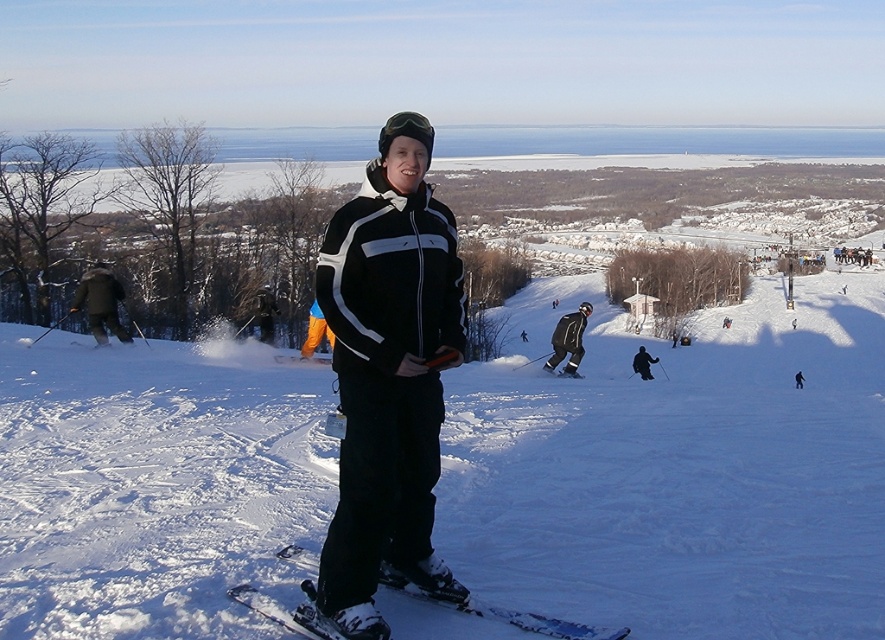
You are a ski instructor preparing for a lesson. You have two skis available in the image, the white plastic ski at center and the black matte ski suit at center. Which one is narrower?

The white plastic ski at center is thinner than the black matte ski suit at center, so the white plastic ski at center is narrower.

You are a photographer at the ski resort and want to capture a photo of the black matte jacket at center and the white plastic ski at center. Which object should you focus on first if you want to include both in the frame without moving the camera?

The black matte jacket at center is positioned on the left side of white plastic ski at center, so you should focus on the black matte jacket at center first to ensure both are in frame without moving the camera.

You are a photographer at the ski resort and want to take a photo of the white plastic ski at center and the black matte ski suit at center. Which object should you focus on first if you want to capture both in a single frame without moving the camera?

The white plastic ski at center has a lesser height compared to black matte ski suit at center, so you should focus on the black matte ski suit at center first to ensure both objects are in focus.